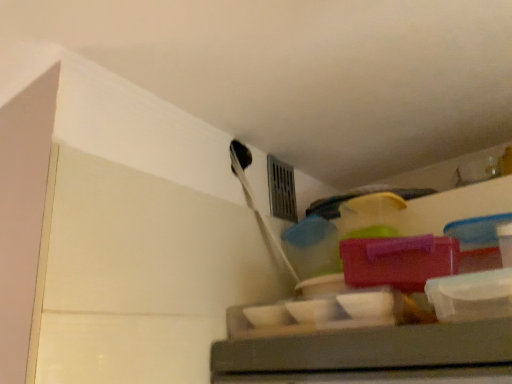
Consider the image. Measure the distance between point (401,290) and camera.

The depth of point (401,290) is 30.87 inches.

What do you see at coordinates (398, 261) in the screenshot? The width and height of the screenshot is (512, 384). I see `matte plastic box at upper right` at bounding box center [398, 261].

This screenshot has width=512, height=384. In order to click on matte plastic box at upper right in this screenshot , I will do `click(398, 261)`.

Locate an element on the screen. This screenshot has width=512, height=384. matte plastic box at upper right is located at coordinates (398, 261).